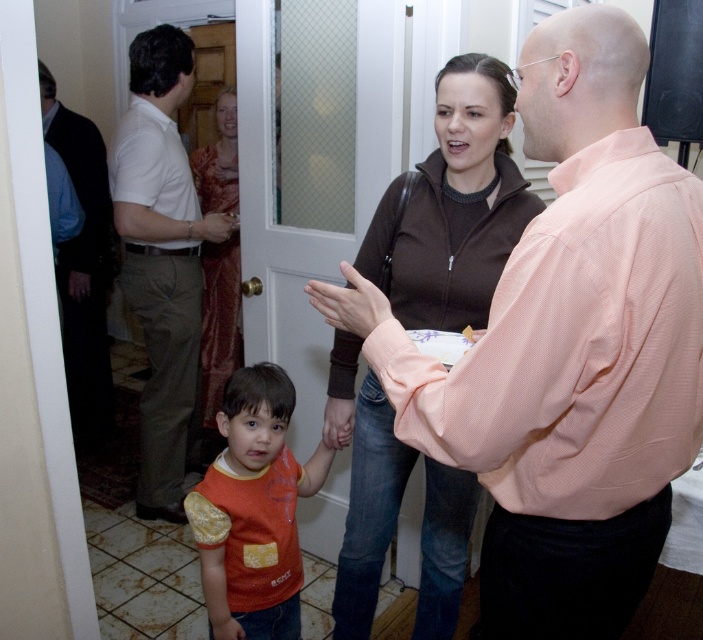
What is located at the coordinates point (160, 259)?

The white cotton shirt at left is located at point (160, 259).

Consider the image. You are at a party and want to know if the silky red sari at door can completely cover the smooth skin hand at center. Based on the scene description, can it?

The silky red sari at door has a larger size compared to smooth skin hand at center, so yes, the silky red sari at door can completely cover the smooth skin hand at center.